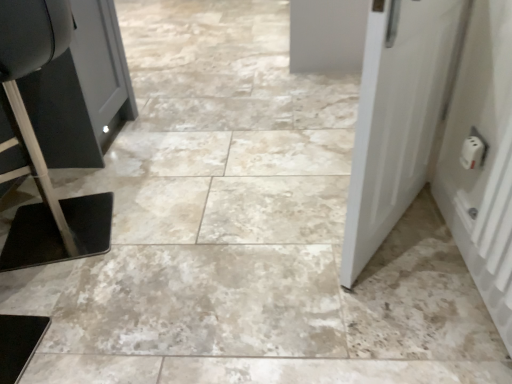
Image resolution: width=512 pixels, height=384 pixels. Find the location of `vacant space behind white matte door at right, positioned as the 2th door in right-to-left order`. vacant space behind white matte door at right, positioned as the 2th door in right-to-left order is located at coordinates coord(306,163).